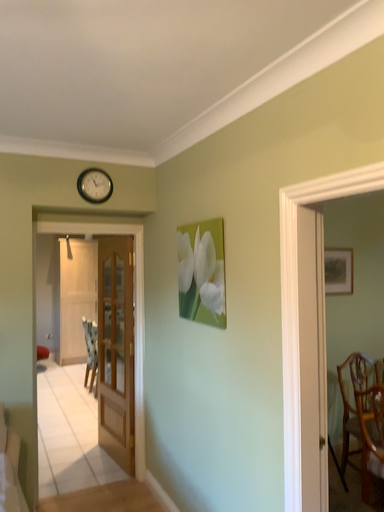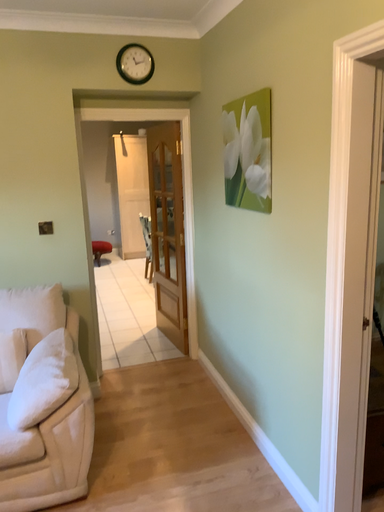
Question: How did the camera likely rotate when shooting the video?

Choices:
 (A) rotated downward
 (B) rotated upward

Answer: (A)